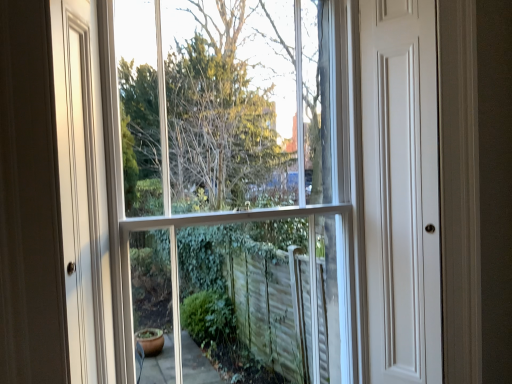
Identify the location of clear glass window at center. (232, 179).

The width and height of the screenshot is (512, 384). What do you see at coordinates (232, 179) in the screenshot? I see `clear glass window at center` at bounding box center [232, 179].

In order to face clear glass window at center, should I rotate leftwards or rightwards?

To align with it, rotate left about 1.501°.

The image size is (512, 384). Identify the location of clear glass window at center. (232, 179).